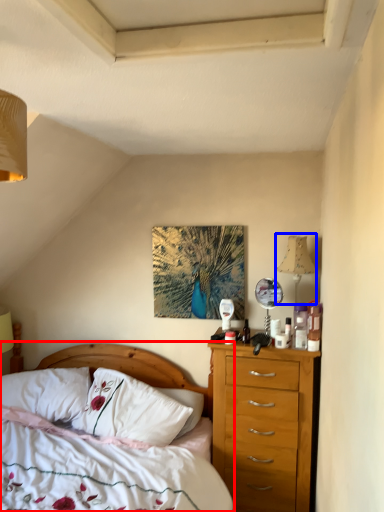
Question: Which object appears closest to the camera in this image, bed (highlighted by a red box) or lamp (highlighted by a blue box)?

Choices:
 (A) bed
 (B) lamp

Answer: (A)